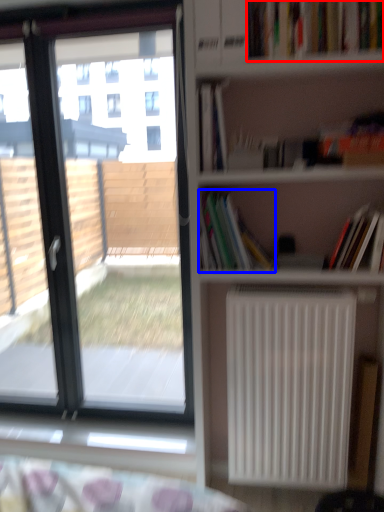
Question: Which object is further to the camera taking this photo, book (highlighted by a red box) or book (highlighted by a blue box)?

Choices:
 (A) book
 (B) book

Answer: (B)